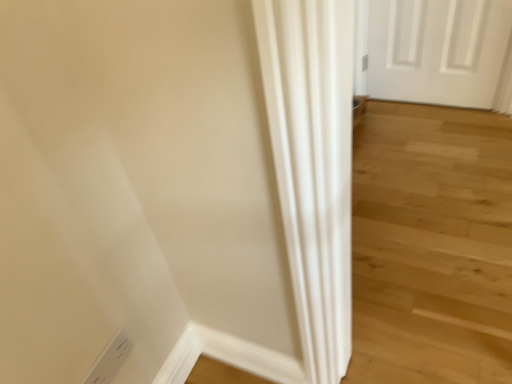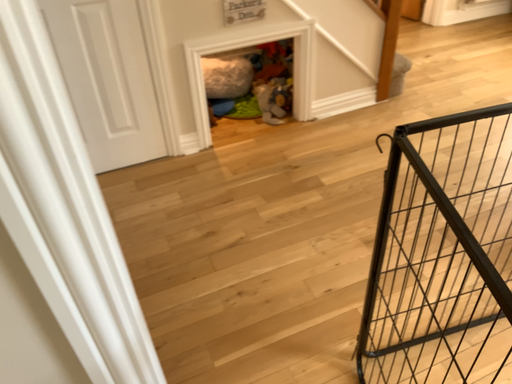
Question: How did the camera likely rotate when shooting the video?

Choices:
 (A) rotated downward
 (B) rotated upward

Answer: (B)